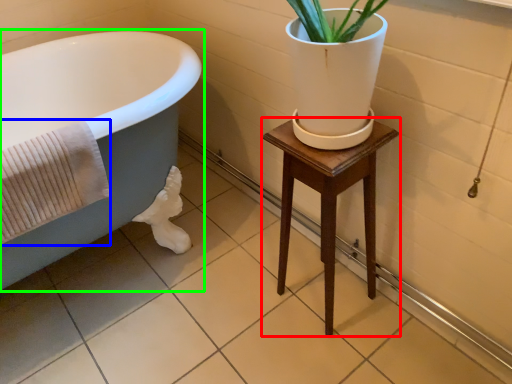
Question: Which is farther away from furniture (highlighted by a red box)? bath towel (highlighted by a blue box) or bathtub (highlighted by a green box)?

Choices:
 (A) bath towel
 (B) bathtub

Answer: (B)